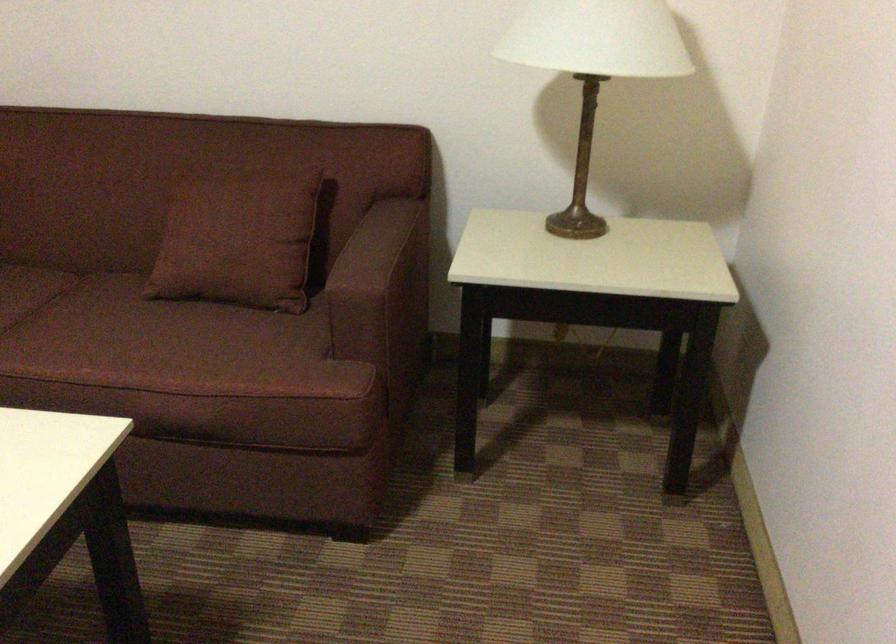
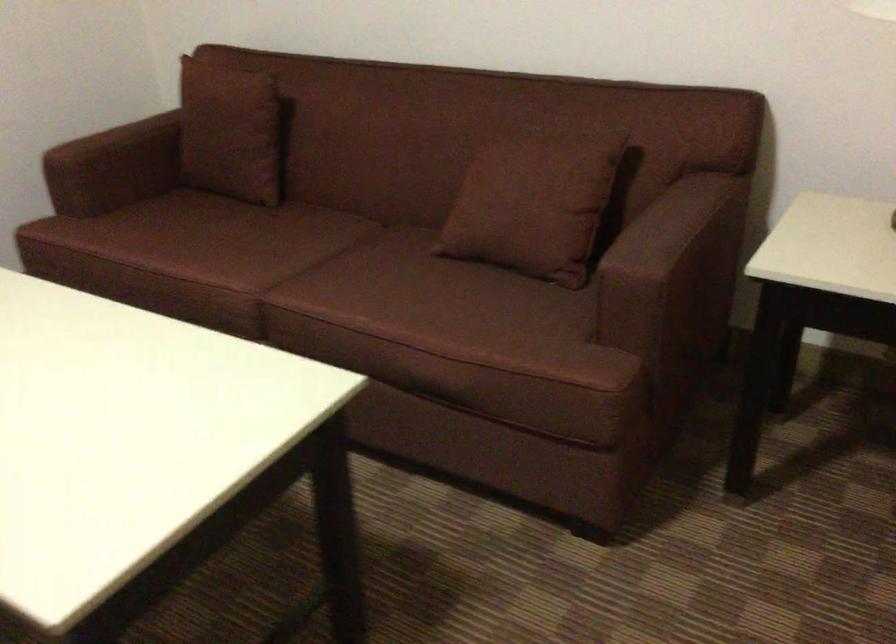
What movement of the cameraman would produce the second image?

The cameraman moved toward right, forward.